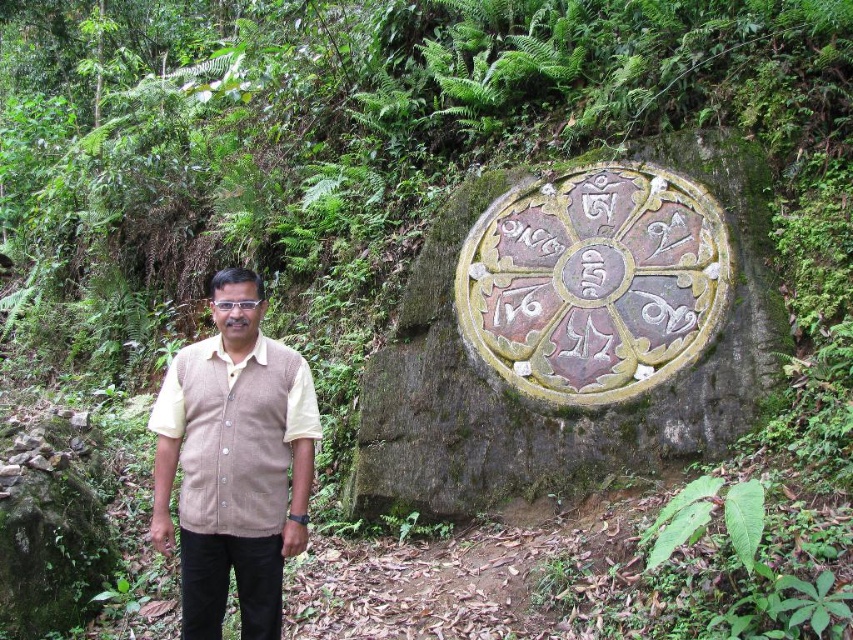
Question: Does carved stone wheel at center have a smaller size compared to beige knitted vest at center?

Choices:
 (A) yes
 (B) no

Answer: (A)

Question: Is carved stone wheel at center below beige knitted vest at center?

Choices:
 (A) no
 (B) yes

Answer: (A)

Question: Which point is farther to the camera?

Choices:
 (A) (531, 184)
 (B) (189, 378)

Answer: (A)

Question: Can you confirm if carved stone wheel at center is positioned to the left of beige knitted vest at center?

Choices:
 (A) yes
 (B) no

Answer: (B)